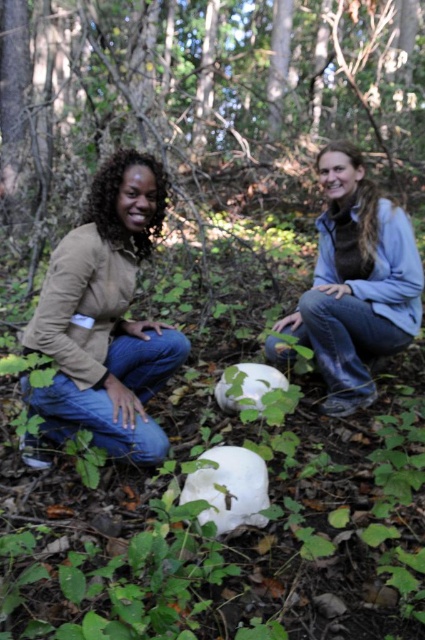
Question: Which object appears closest to the camera in this image?

Choices:
 (A) matte beige sweater at lower left
 (B) rough bark tree at center

Answer: (A)

Question: Which object appears closest to the camera in this image?

Choices:
 (A) matte beige sweater at lower left
 (B) rough bark tree at center

Answer: (A)

Question: Is rough bark tree at center to the left of white matte pumpkin at center from the viewer's perspective?

Choices:
 (A) no
 (B) yes

Answer: (B)

Question: Can you confirm if rough bark tree at center is thinner than white matte pumpkin at center?

Choices:
 (A) yes
 (B) no

Answer: (B)

Question: Which of the following is the closest to the observer?

Choices:
 (A) matte beige sweater at lower left
 (B) rough bark tree at center

Answer: (A)

Question: Can you confirm if rough bark tree at center is wider than matte beige sweater at lower left?

Choices:
 (A) no
 (B) yes

Answer: (B)